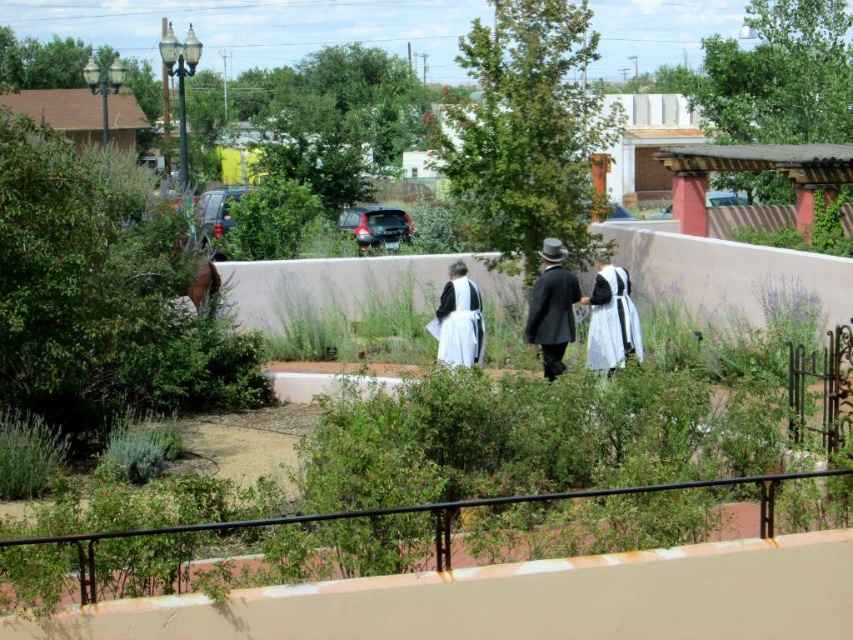
Question: Which object is farther from the camera taking this photo?

Choices:
 (A) white satin dress at center
 (B) matte black coat at center

Answer: (A)

Question: Which is nearer to the white matte dress at center?

Choices:
 (A) matte black coat at center
 (B) white satin dress at center

Answer: (A)

Question: Does matte black coat at center have a greater width compared to white matte dress at center?

Choices:
 (A) yes
 (B) no

Answer: (B)

Question: Where is white matte dress at center located in relation to white satin dress at center in the image?

Choices:
 (A) right
 (B) left

Answer: (A)

Question: Does matte black coat at center have a larger size compared to white matte dress at center?

Choices:
 (A) yes
 (B) no

Answer: (B)

Question: Which object is the closest to the white matte dress at center?

Choices:
 (A) white satin dress at center
 (B) matte black coat at center

Answer: (B)